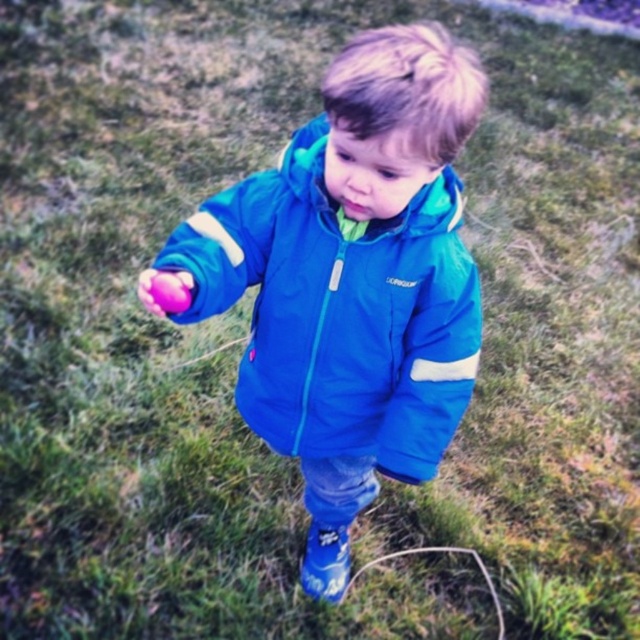
Between blue fabric jacket at center and shiny purple ball at center, which one has more height?

blue fabric jacket at center

Is blue fabric jacket at center taller than shiny purple ball at center?

Indeed, blue fabric jacket at center has a greater height compared to shiny purple ball at center.

Which is behind, point (266, 250) or point (164, 305)?

Point (266, 250)

Identify the location of blue fabric jacket at center. (339, 312).